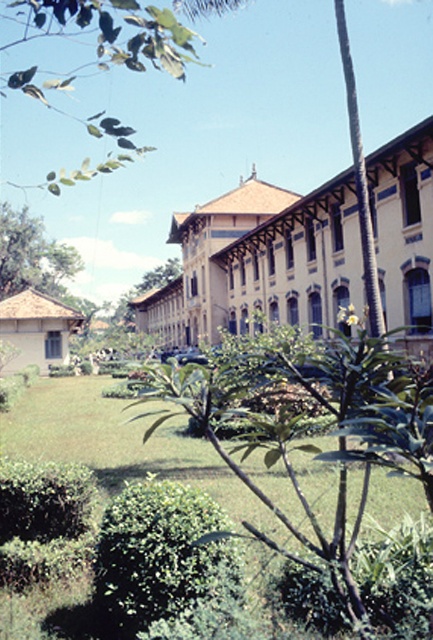
You are standing at the center of the garden in front of the beige wooden palace. You want to take a photo of the palace using a camera that requires you to stand exactly at point (259, 260) to frame it perfectly. Are you already positioned correctly?

Yes, you are already positioned correctly at point (259, 260) because the beige wooden palace is located at that point.